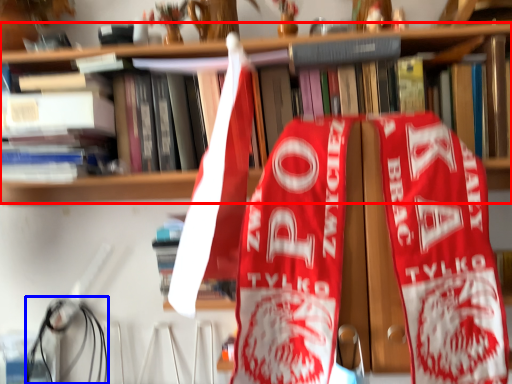
Question: Which of the following is the farthest to the observer, bookcase (highlighted by a red box) or wire (highlighted by a blue box)?

Choices:
 (A) bookcase
 (B) wire

Answer: (B)